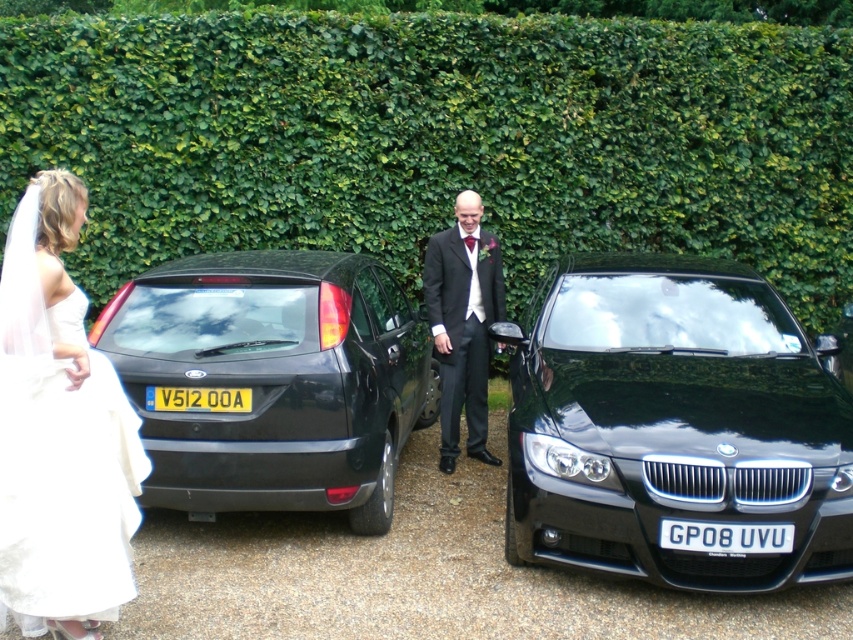
Question: Among these points, which one is farthest from the camera?

Choices:
 (A) (503, 212)
 (B) (469, 420)
 (C) (570, 499)

Answer: (A)

Question: Can you confirm if green leafy hedge at upper center is bigger than yellowmaterial/texturelicense plate at center?

Choices:
 (A) yes
 (B) no

Answer: (A)

Question: Can you confirm if shiny black hatchback at center is wider than matte black suit at center?

Choices:
 (A) no
 (B) yes

Answer: (B)

Question: Among these points, which one is nearest to the camera?

Choices:
 (A) (402, 216)
 (B) (200, 387)

Answer: (B)

Question: Which object is the closest to the shiny black hatchback at center?

Choices:
 (A) matte black suit at center
 (B) white plastic license plate at center

Answer: (A)

Question: Where is green leafy hedge at upper center located in relation to shiny black hatchback at center in the image?

Choices:
 (A) right
 (B) left

Answer: (A)